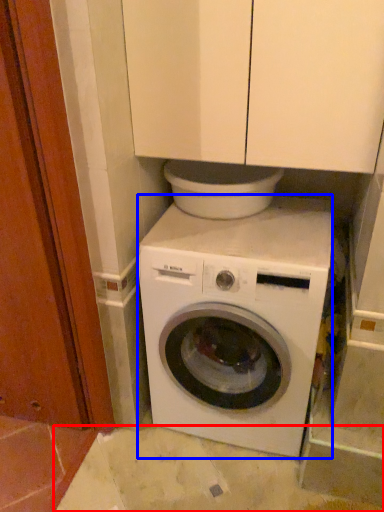
Question: Among these objects, which one is nearest to the camera, concrete (highlighted by a red box) or washing machine (highlighted by a blue box)?

Choices:
 (A) concrete
 (B) washing machine

Answer: (B)